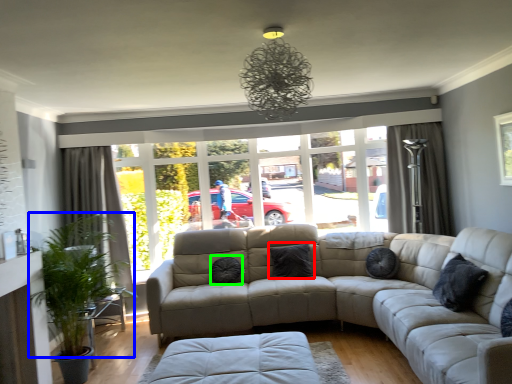
Question: Which object is positioned farthest from pillow (highlighted by a red box)? Select from plant (highlighted by a blue box) and pillow (highlighted by a green box).

Choices:
 (A) plant
 (B) pillow

Answer: (A)